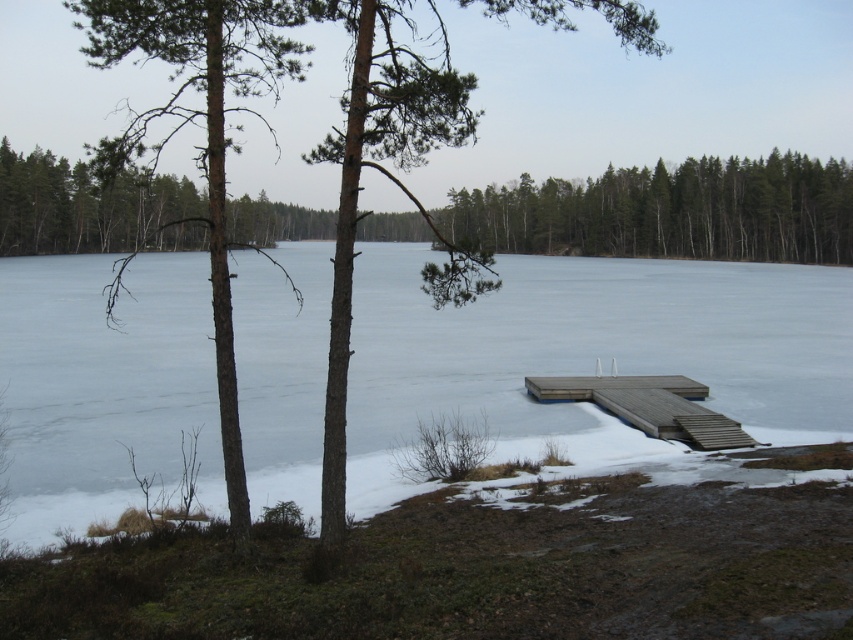
Question: Can you confirm if frozen ice at center is positioned to the right of brown textured tree at center?

Choices:
 (A) yes
 (B) no

Answer: (A)

Question: Does brown wood tree at center have a larger size compared to smooth brown tree trunk at left?

Choices:
 (A) yes
 (B) no

Answer: (B)

Question: Among these objects, which one is nearest to the camera?

Choices:
 (A) brown textured tree at center
 (B) smooth brown tree trunk at left
 (C) brown wood tree at center

Answer: (A)

Question: Is the position of brown textured tree at center more distant than that of brown wood tree at center?

Choices:
 (A) yes
 (B) no

Answer: (B)

Question: Which object is positioned closest to the brown wooden dock at lower right?

Choices:
 (A) frozen ice at center
 (B) smooth brown tree trunk at left
 (C) brown wooden dock at center

Answer: (C)

Question: Among these objects, which one is farthest from the camera?

Choices:
 (A) brown wooden dock at center
 (B) smooth brown tree trunk at left
 (C) brown wood tree at center
 (D) brown textured tree at center

Answer: (A)